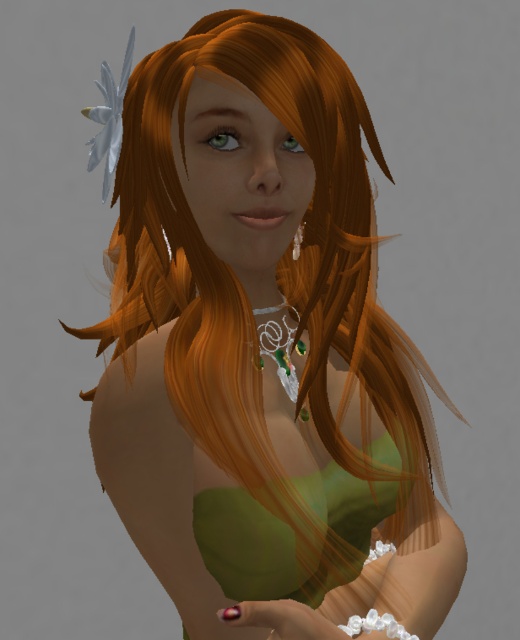
You are a photographer adjusting your camera settings to capture the shiny pink nail polish at lower center. The camera requires the subject to be at least 60 centimeters away to avoid blurring. Based on the scene description, will the nail polish be in focus?

The shiny pink nail polish at lower center is 53.60 centimeters from the camera, which is closer than the required 60 centimeters. Therefore, the nail polish may appear blurry in the photo.

You are a fashion stylist preparing for a photoshoot. You need to decide which accessory to highlight first based on their sizes. Given the scene, which object should you focus on first between the shiny pink nail polish at lower center and the green gemstone earring at center?

The shiny pink nail polish at lower center has a greater height compared to the green gemstone earring at center, so you should focus on the shiny pink nail polish at lower center first because it is larger in size.

You are a fashion designer observing the character in the image. You need to determine the spatial relationship between the green matte dress at center and the shiny pink nail polish at lower center. Which object is positioned higher up in the image?

The green matte dress at center is taller than shiny pink nail polish at lower center, so the green matte dress at center is positioned higher up in the image.